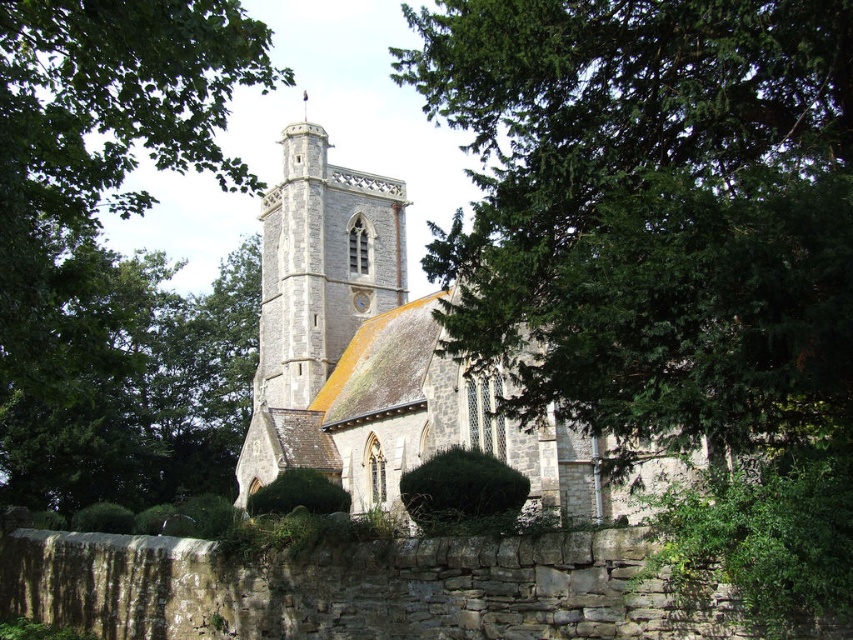
You are standing in front of the church and want to take a photo that includes both the tower with the clock face and the aged stone wall in the foreground. Which of the two points, point [280,355] or point [334,342], should you focus on to ensure both elements are in sharp focus?

You should focus on point [280,355] because it is closer to the camera than point [334,342]. By focusing on the closer point, the depth of field will likely include both the tower and the wall in sharp focus.

You are standing at the point marked by coordinates point (374, 353). Based on the scene description, what structure are you directly facing?

The point (374, 353) marks the stone church at center, so you are directly facing the stone church at center.